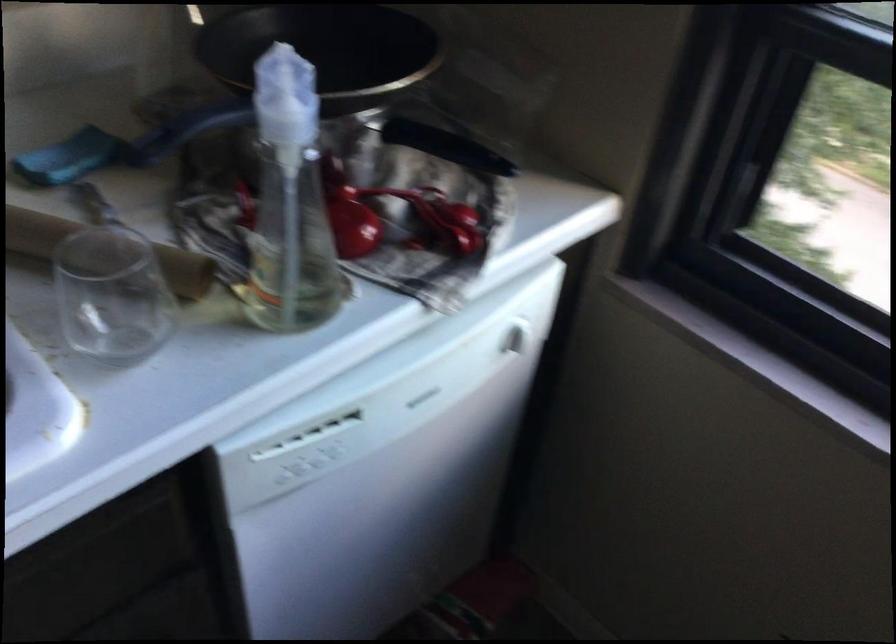
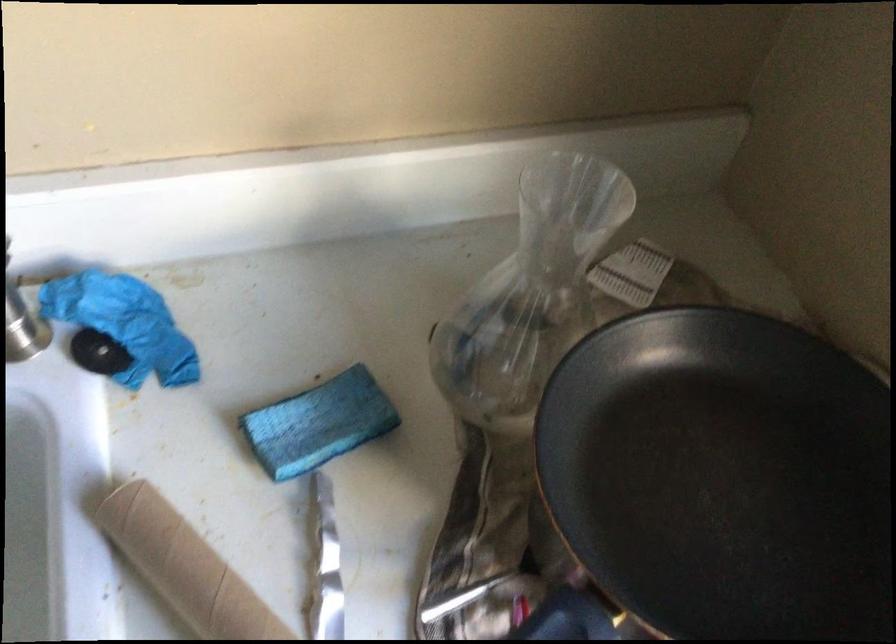
Question: The camera is either moving clockwise (left) or counter-clockwise (right) around the object. The first image is from the beginning of the video and the second image is from the end. Is the camera moving left or right when shooting the video?

Choices:
 (A) Left
 (B) Right

Answer: (B)